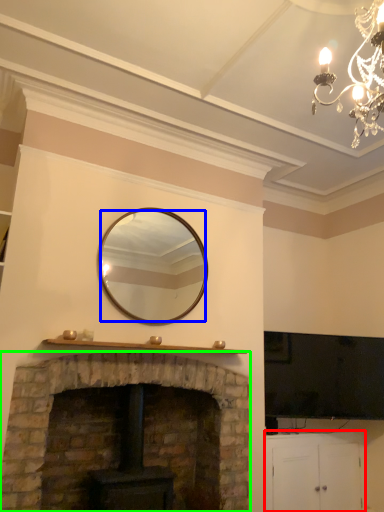
Question: Estimate the real-world distances between objects in this image. Which object is closer to cabinetry (highlighted by a red box), mirror (highlighted by a blue box) or fireplace (highlighted by a green box)?

Choices:
 (A) mirror
 (B) fireplace

Answer: (B)